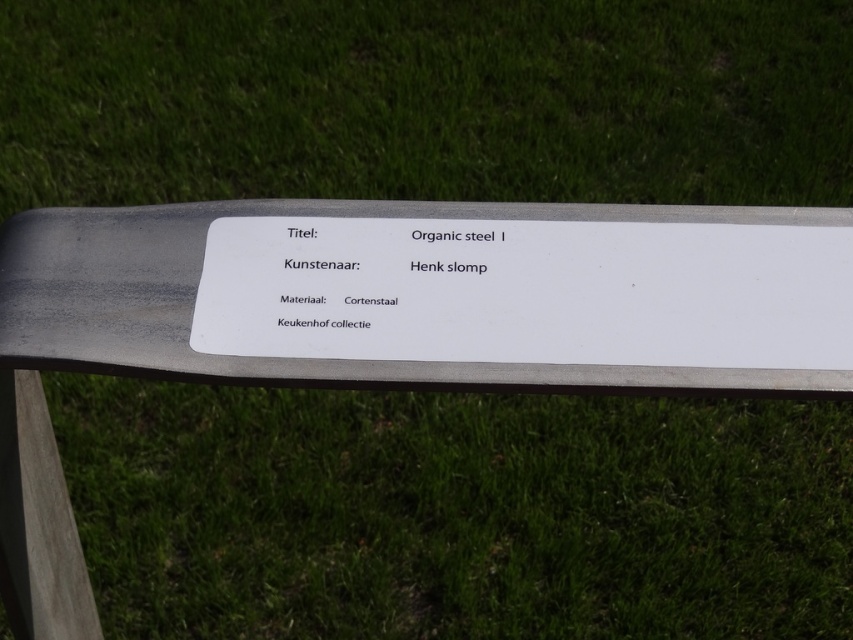
What are the coordinates of the cortensteel sign at center?

The coordinates of the cortensteel sign at center are at point (x=292, y=358).

You are an art student observing the sculpture and its sign. Can you tell me which object is closer to you between the cortensteel sign at center and the white organic steel i at center?

The cortensteel sign at center is in front of the white organic steel i at center, so it is closer to you.

You are a visitor at Keukenhof and see the cortensteel sign at center and the white organic steel i at center. Which object is positioned lower in the image?

The cortensteel sign at center is positioned below the white organic steel i at center, so it is lower in the image.